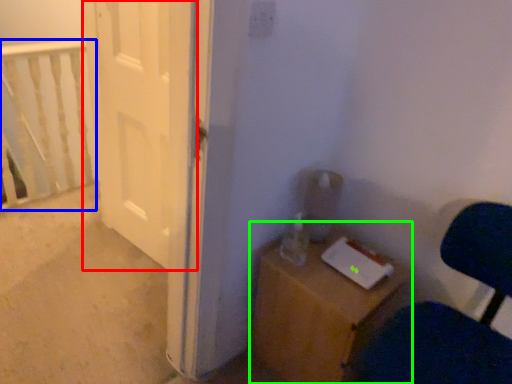
Question: Based on their relative distances, which object is nearer to door (highlighted by a red box)? Choose from rail (highlighted by a blue box) and furniture (highlighted by a green box).

Choices:
 (A) rail
 (B) furniture

Answer: (A)